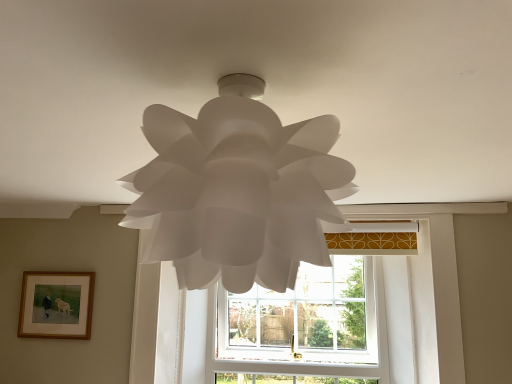
Question: Is the surface of wooden framed picture at lower left in direct contact with white paper lamp at center?

Choices:
 (A) no
 (B) yes

Answer: (A)

Question: From a real-world perspective, is wooden framed picture at lower left located higher than white paper lamp at center?

Choices:
 (A) yes
 (B) no

Answer: (B)

Question: Is wooden framed picture at lower left to the right of white paper lamp at center from the viewer's perspective?

Choices:
 (A) no
 (B) yes

Answer: (A)

Question: Does wooden framed picture at lower left have a larger size compared to white paper lamp at center?

Choices:
 (A) no
 (B) yes

Answer: (A)

Question: Does wooden framed picture at lower left appear on the left side of white paper lamp at center?

Choices:
 (A) yes
 (B) no

Answer: (A)

Question: Considering the relative sizes of wooden framed picture at lower left and white paper lamp at center in the image provided, is wooden framed picture at lower left wider than white paper lamp at center?

Choices:
 (A) yes
 (B) no

Answer: (B)

Question: Could you tell me if white paper lamp at center is turned towards white plastic window at center?

Choices:
 (A) no
 (B) yes

Answer: (A)

Question: Is white paper lamp at center far from white plastic window at center?

Choices:
 (A) no
 (B) yes

Answer: (B)

Question: Does white paper lamp at center have a lesser width compared to white plastic window at center?

Choices:
 (A) no
 (B) yes

Answer: (A)

Question: Is white paper lamp at center bigger than white plastic window at center?

Choices:
 (A) yes
 (B) no

Answer: (B)

Question: From a real-world perspective, is white paper lamp at center positioned under white plastic window at center based on gravity?

Choices:
 (A) no
 (B) yes

Answer: (A)

Question: From the image's perspective, is white paper lamp at center on white plastic window at center?

Choices:
 (A) yes
 (B) no

Answer: (A)

Question: Is white plastic window at center at the back of wooden framed picture at lower left?

Choices:
 (A) no
 (B) yes

Answer: (A)